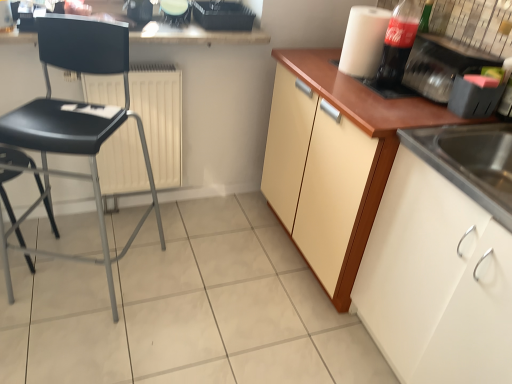
Question: Which direction should I rotate to face white glossy blender at upper center, placed as the 1th appliance when sorted from left to right, — up or down?

Choices:
 (A) up
 (B) down

Answer: (A)

Question: Can you confirm if black plastic chair at left, the first chair viewed from the left, is positioned to the left of stainless steel sink at lower right?

Choices:
 (A) no
 (B) yes

Answer: (B)

Question: Is black plastic chair at left, the first chair viewed from the left, in front of stainless steel sink at lower right?

Choices:
 (A) yes
 (B) no

Answer: (B)

Question: Would you say stainless steel sink at lower right is part of black plastic chair at left, the 2th chair when ordered from right to left,'s contents?

Choices:
 (A) yes
 (B) no

Answer: (B)

Question: Is black plastic chair at left, the first chair viewed from the left, positioned far away from stainless steel sink at lower right?

Choices:
 (A) yes
 (B) no

Answer: (A)

Question: Can you confirm if black plastic chair at left, the 2th chair when ordered from right to left, is thinner than stainless steel sink at lower right?

Choices:
 (A) no
 (B) yes

Answer: (B)

Question: Can you confirm if black plastic chair at left, the first chair viewed from the left, is positioned to the right of stainless steel sink at lower right?

Choices:
 (A) no
 (B) yes

Answer: (A)

Question: From the image's perspective, is white glossy blender at upper center, placed as the 1th appliance when sorted from left to right, above translucent plastic bottle at upper right?

Choices:
 (A) yes
 (B) no

Answer: (A)

Question: Does white glossy blender at upper center, placed as the 1th appliance when sorted from left to right, contain translucent plastic bottle at upper right?

Choices:
 (A) yes
 (B) no

Answer: (B)

Question: From the image's perspective, is white glossy blender at upper center, which appears as the 3th appliance when viewed from the right, beneath translucent plastic bottle at upper right?

Choices:
 (A) yes
 (B) no

Answer: (B)

Question: Does white glossy blender at upper center, placed as the 1th appliance when sorted from left to right, appear on the right side of translucent plastic bottle at upper right?

Choices:
 (A) no
 (B) yes

Answer: (A)

Question: Can you confirm if white glossy blender at upper center, which appears as the 3th appliance when viewed from the right, is bigger than translucent plastic bottle at upper right?

Choices:
 (A) no
 (B) yes

Answer: (A)

Question: Can you confirm if white glossy blender at upper center, which appears as the 3th appliance when viewed from the right, is taller than translucent plastic bottle at upper right?

Choices:
 (A) no
 (B) yes

Answer: (A)

Question: Does smooth white countertop at upper center have a lesser width compared to white matte radiator at center?

Choices:
 (A) yes
 (B) no

Answer: (B)